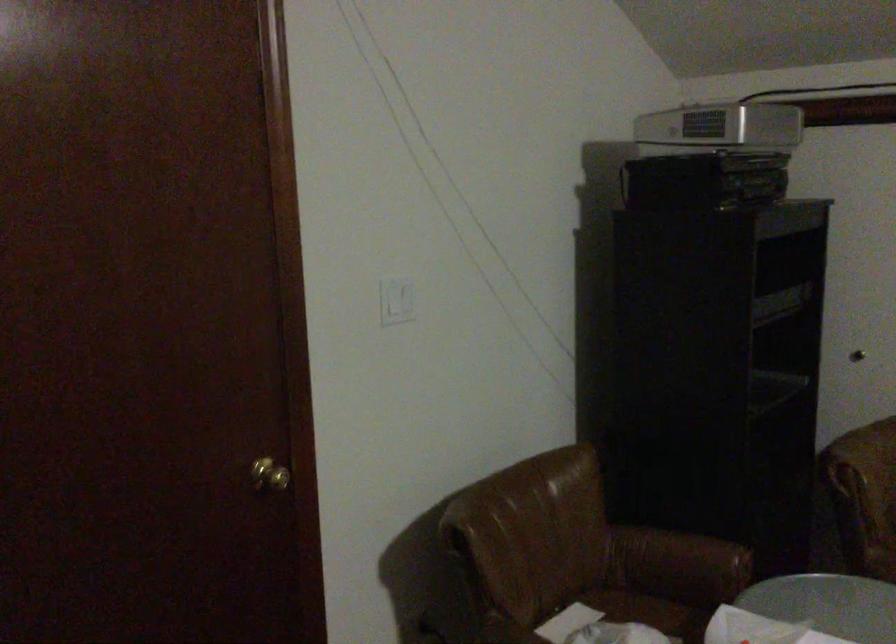
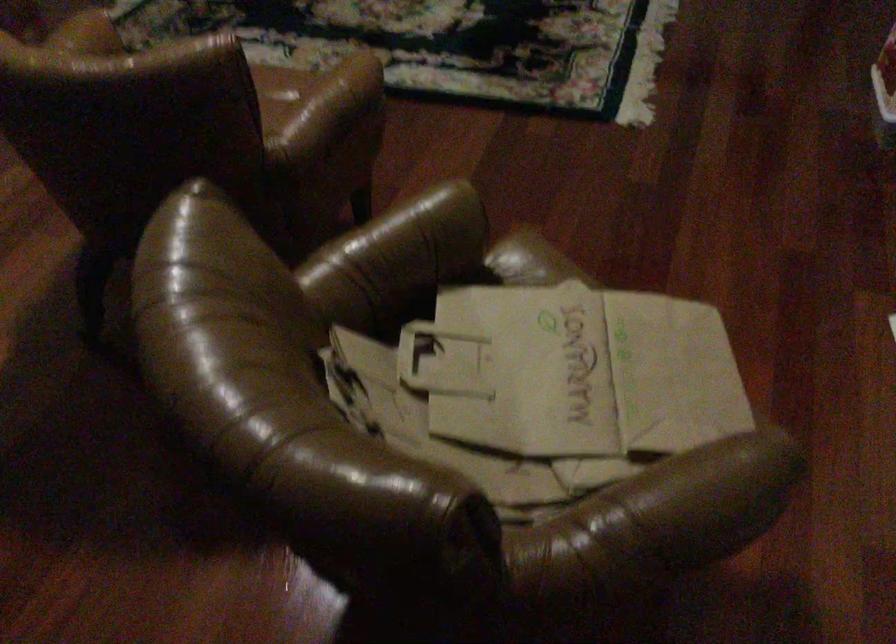
How did the camera likely rotate?

The camera rotated toward right-down.